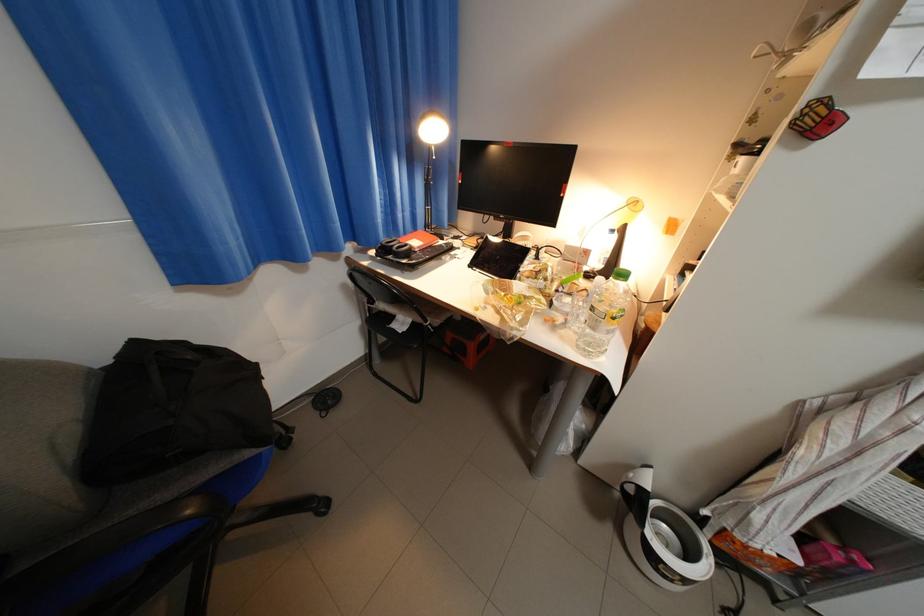
Find where to sit the black chair sitting surface. Please return your answer as a coordinate pair (x, y).

(391, 323)